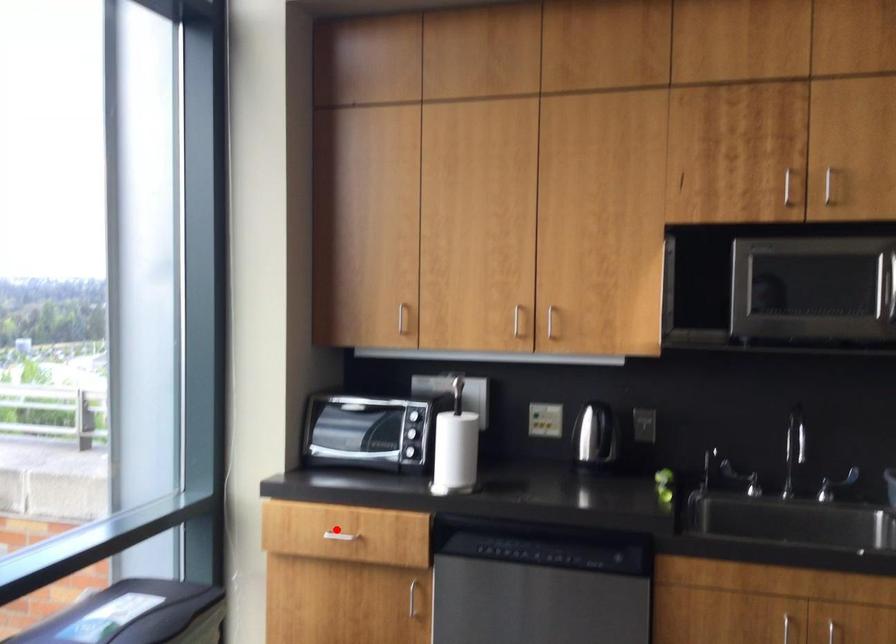
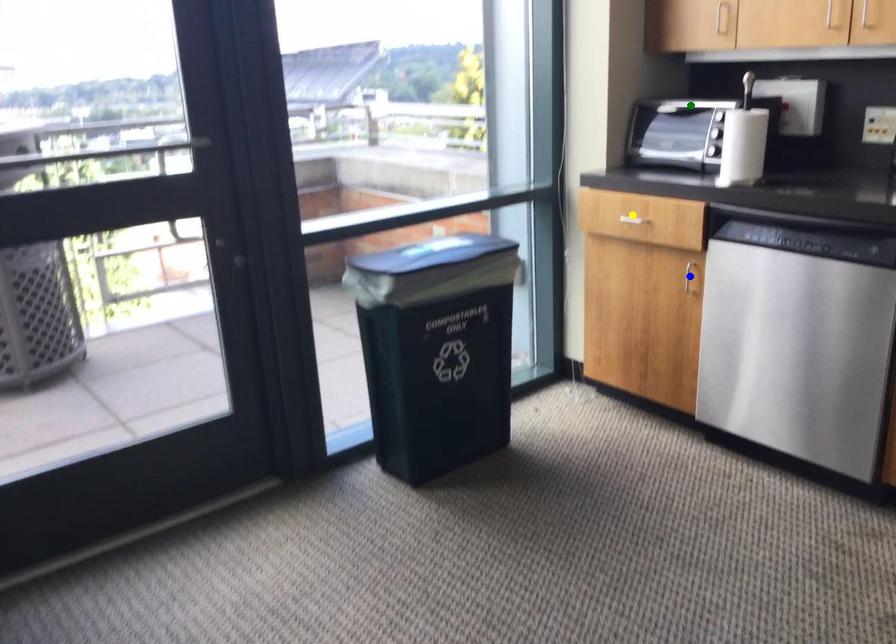
Question: I am providing you with two images of the same scene from different viewpoints. A red point is marked on the first image. You are given multiple points on the second image. Which point in image 2 is actually the same real-world point as the red point in image 1?

Choices:
 (A) green point
 (B) blue point
 (C) yellow point

Answer: (C)